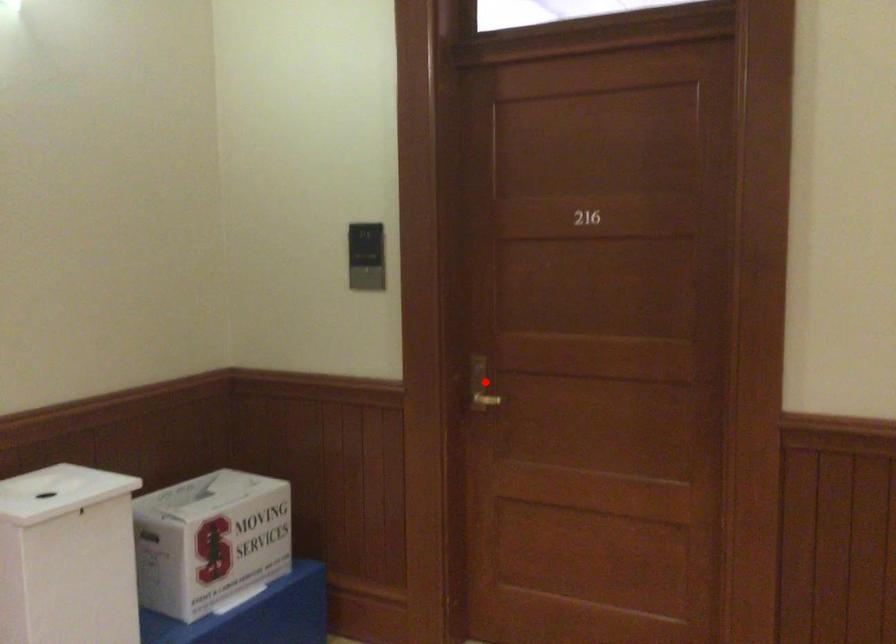
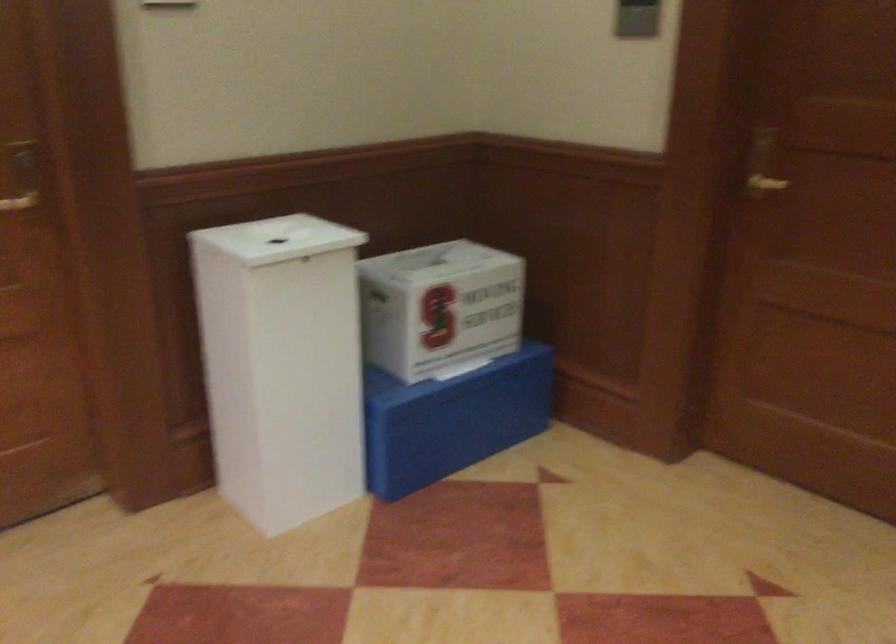
Question: I am providing you with two images of the same scene from different viewpoints. A red point is shown in image1. For the corresponding object point in image2, is it positioned nearer or farther from the camera?

Choices:
 (A) Nearer
 (B) Farther

Answer: (A)